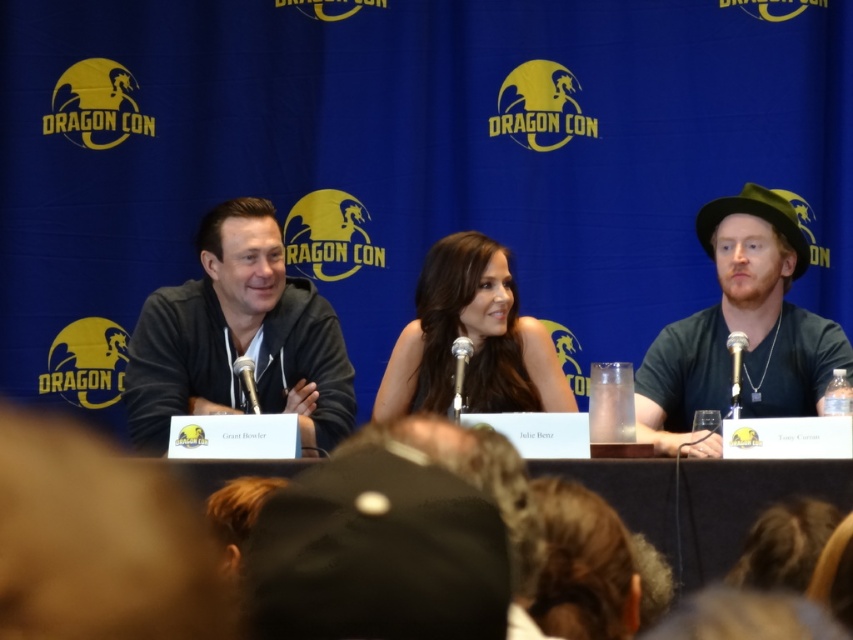
Question: Is the position of dark gray hoodie at left less distant than that of matte black hat at right?

Choices:
 (A) no
 (B) yes

Answer: (B)

Question: Which point appears farthest from the camera in this image?

Choices:
 (A) (247, 268)
 (B) (494, 273)
 (C) (782, 202)

Answer: (B)

Question: Based on their relative distances, which object is nearer to the matte black hat at right?

Choices:
 (A) satin black dress at center
 (B) dark gray hoodie at left

Answer: (A)

Question: Is matte black hat at right bigger than satin black dress at center?

Choices:
 (A) yes
 (B) no

Answer: (A)

Question: Which object appears closest to the camera in this image?

Choices:
 (A) dark gray hoodie at left
 (B) matte black hat at right
 (C) satin black dress at center

Answer: (A)

Question: Can you confirm if dark gray hoodie at left is thinner than satin black dress at center?

Choices:
 (A) no
 (B) yes

Answer: (A)